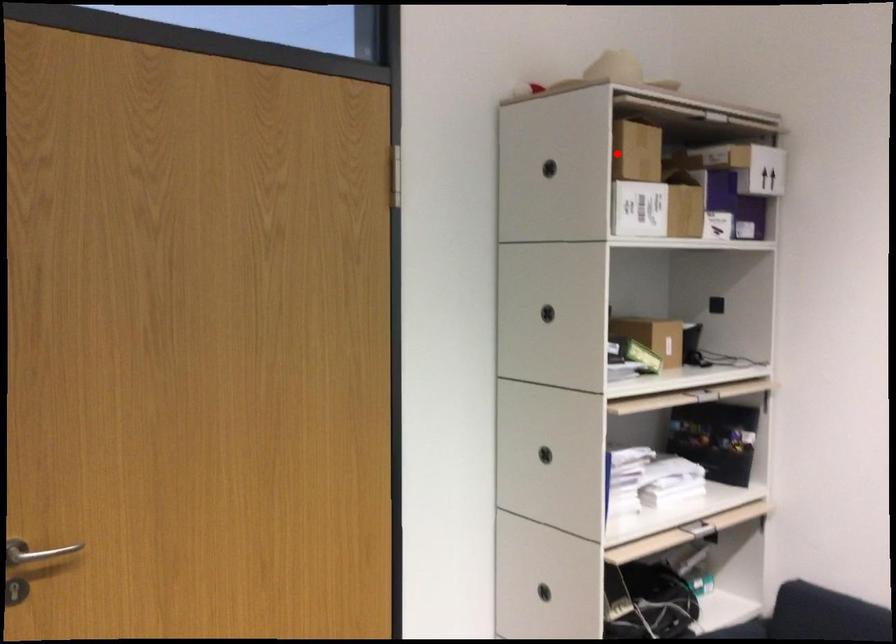
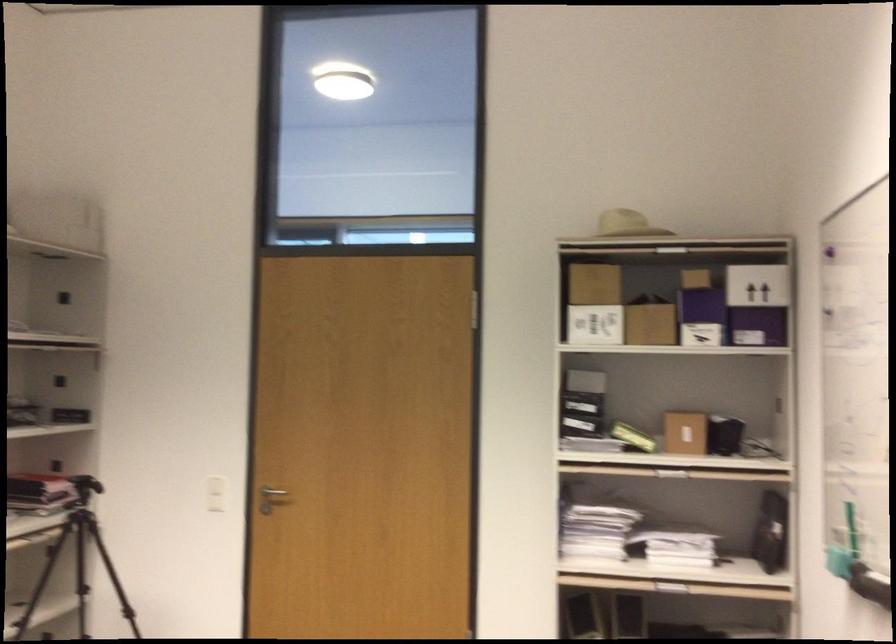
Where in the second image is the point corresponding to the highlighted location from the first image?

(592, 283)